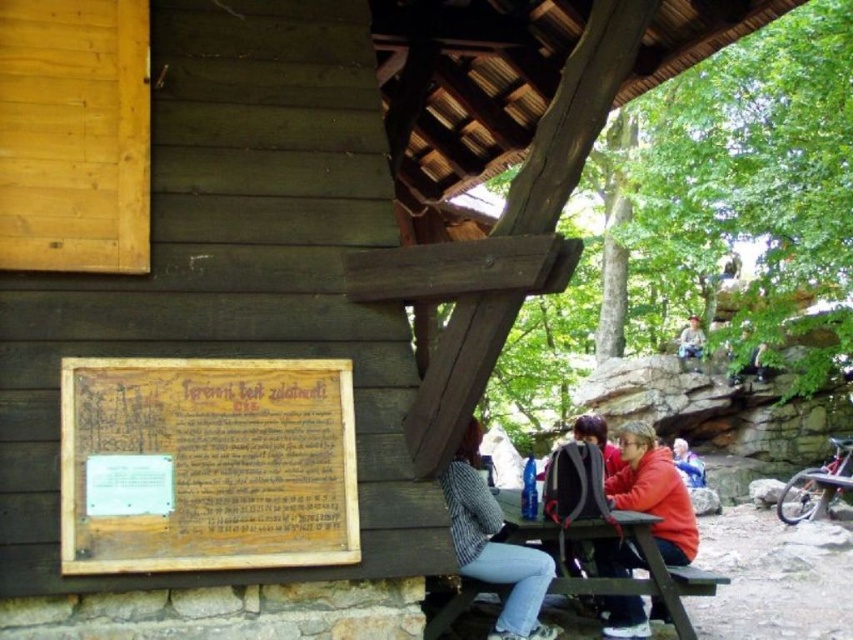
You are standing in front of the wooden building and notice two points marked on its signboard. The first point is at coordinates point (674, 467) and the second at point (527, 600). Which point is closer to you?

Point (674, 467) is further to the viewer than point (527, 600), so the point closer to you is point (527, 600).

You are organizing an outdoor event and need to place a large banner. The banner is bigger than the striped fabric jacket at center. Can the wooden sign at left accommodate the banner?

The wooden sign at left occupies less space than the striped fabric jacket at center. Since the banner is larger than the striped fabric jacket at center, it cannot fit on the wooden sign at left.